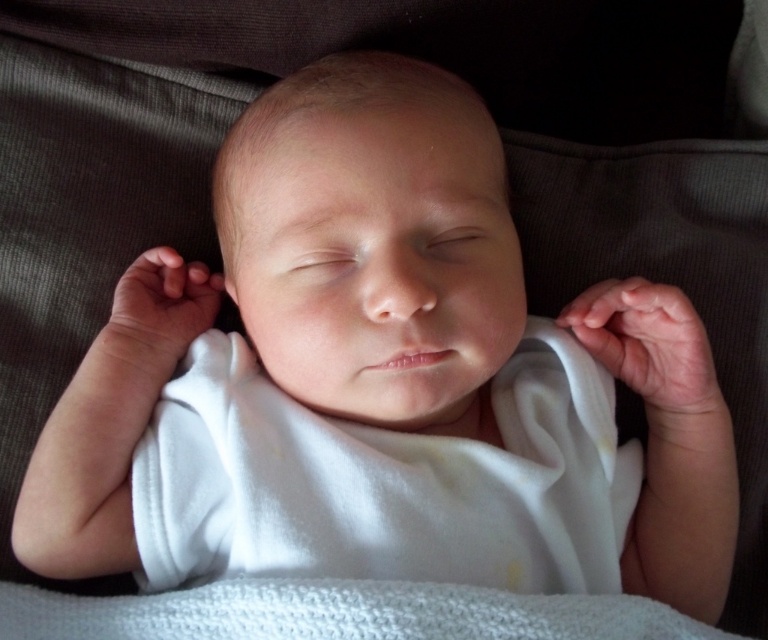
Describe the element at coordinates (372, 241) in the screenshot. This screenshot has width=768, height=640. I see `smooth white baby at center` at that location.

Which of these two, smooth white baby at center or white knitted blanket at center, stands shorter?

With less height is white knitted blanket at center.

Is point (449, 198) farther from camera compared to point (204, 627)?

Yes.

Locate an element on the screen. The image size is (768, 640). smooth white baby at center is located at coordinates (372, 241).